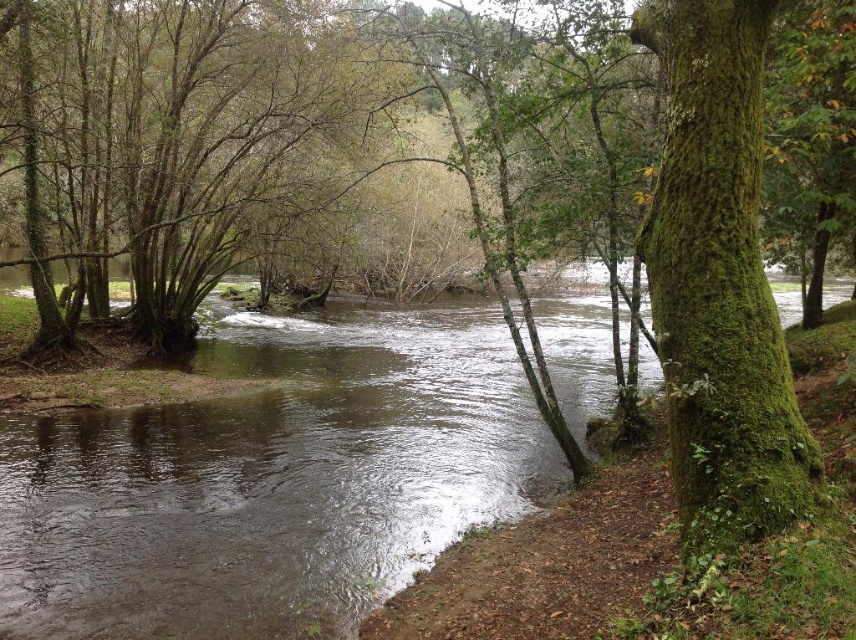
Question: Is clear water at center wider than green mossy tree at right?

Choices:
 (A) yes
 (B) no

Answer: (A)

Question: Which of the following is the closest to the observer?

Choices:
 (A) (645, 19)
 (B) (146, 579)

Answer: (A)

Question: Which point appears closest to the camera in this image?

Choices:
 (A) (764, 381)
 (B) (479, 492)

Answer: (A)

Question: Does clear water at center have a lesser width compared to green mossy tree at right?

Choices:
 (A) yes
 (B) no

Answer: (B)

Question: Considering the relative positions of clear water at center and green mossy tree at right in the image provided, where is clear water at center located with respect to green mossy tree at right?

Choices:
 (A) below
 (B) above

Answer: (B)